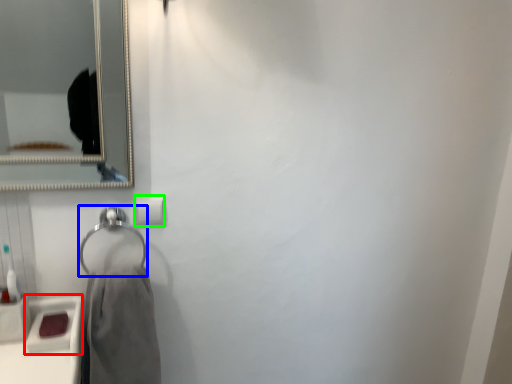
Question: Which object is the farthest from sink (highlighted by a red box)? Choose among these: hang (highlighted by a blue box) or toilet paper (highlighted by a green box).

Choices:
 (A) hang
 (B) toilet paper

Answer: (B)